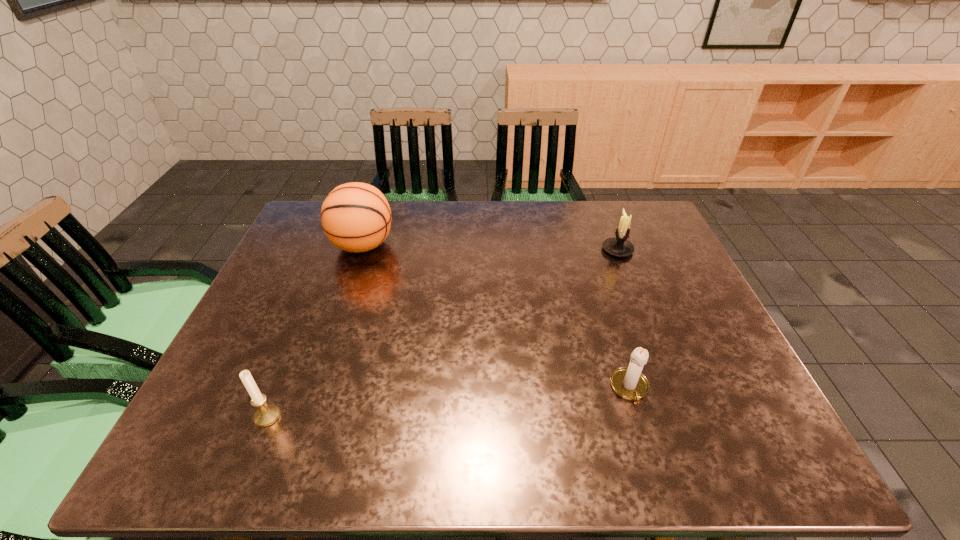
The width and height of the screenshot is (960, 540). In order to click on basketball in this screenshot , I will do `click(356, 217)`.

At what (x,y) coordinates should I click in order to perform the action: click on the rightmost object. Please return your answer as a coordinate pair (x, y). The image size is (960, 540). Looking at the image, I should click on (619, 246).

I want to click on the farthest candle holder, so (x=619, y=246).

Find the location of a particular element. The image size is (960, 540). the leftmost candle holder is located at coordinates (267, 414).

Locate an element on the screen. the second object from right to left is located at coordinates (628, 382).

The image size is (960, 540). In order to click on the second candle holder from right to left in this screenshot , I will do `click(628, 382)`.

The width and height of the screenshot is (960, 540). Find the location of `vacant space located on the right of the basketball`. vacant space located on the right of the basketball is located at coordinates (435, 245).

I want to click on vacant space situated on the front of the rightmost object, so click(x=630, y=283).

I want to click on vacant space located 0.070m on the left of the leftmost candle holder, so point(221,416).

Identify the location of blank area located on the handle side of the shortest candle holder. (649, 455).